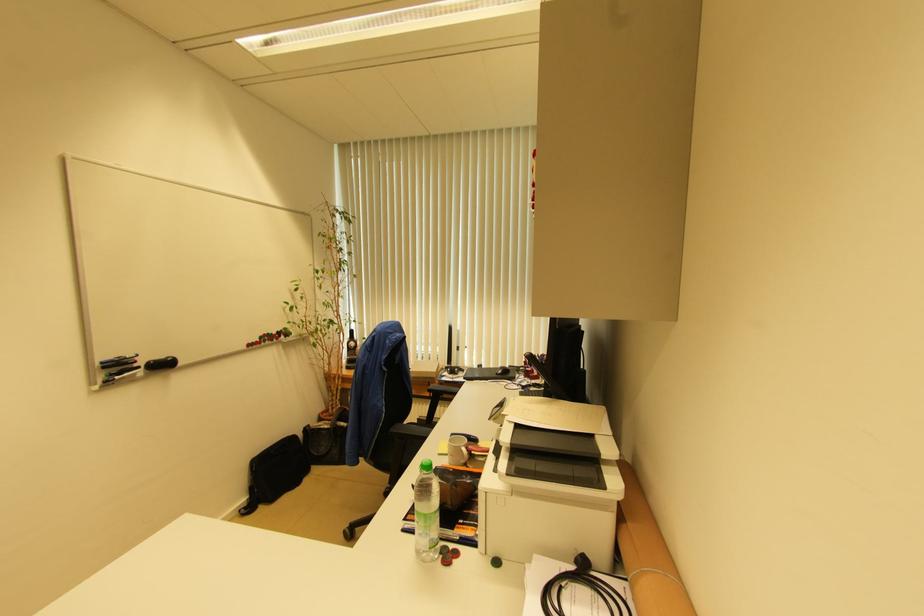
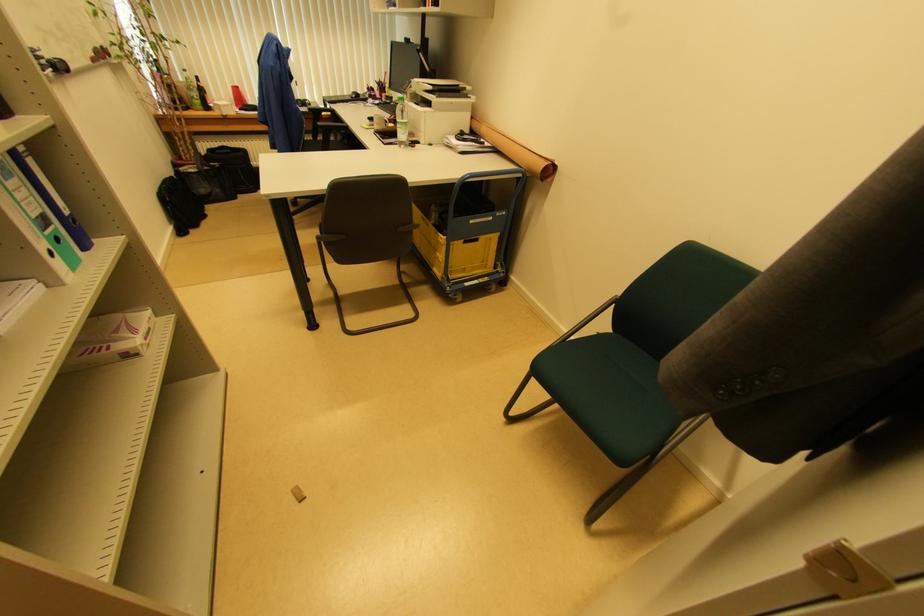
In the second image, find the point that corresponds to pixel 611 519 in the first image.

(469, 118)